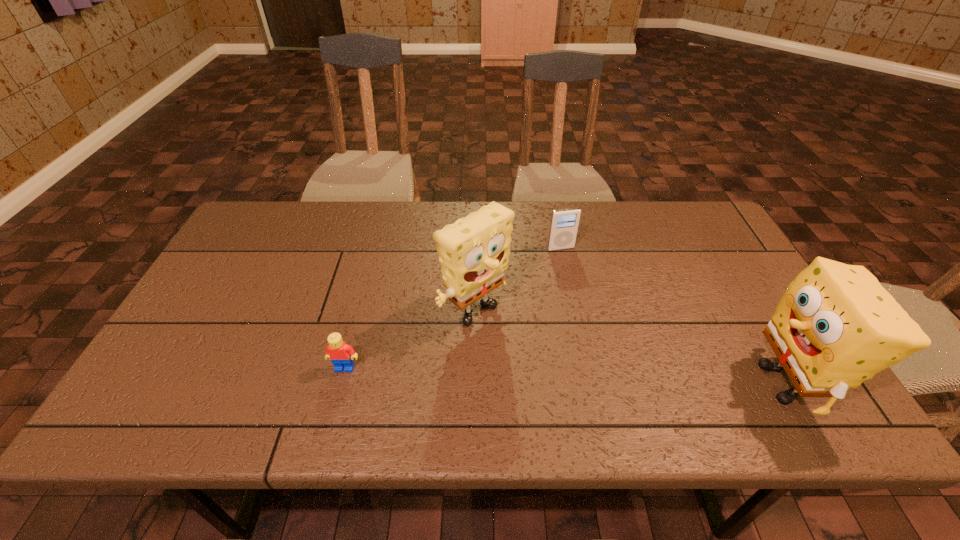
Image resolution: width=960 pixels, height=540 pixels. In order to click on the shortest object in this screenshot , I will do `click(341, 354)`.

Where is `the leftmost object`? This screenshot has width=960, height=540. the leftmost object is located at coordinates (341, 354).

The image size is (960, 540). Find the location of `the right sponge`. the right sponge is located at coordinates (836, 326).

Locate an element on the screen. This screenshot has width=960, height=540. the third object from right to left is located at coordinates (473, 251).

Where is `the third tallest object`? the third tallest object is located at coordinates (564, 223).

You are a GUI agent. You are given a task and a screenshot of the screen. Output one action in this format:
    pyautogui.click(x=<x>, y=<y>)
    Task: Click on the iPod
    The height and width of the screenshot is (540, 960).
    Given the screenshot: What is the action you would take?
    pyautogui.click(x=564, y=223)

Identify the location of free region located on the face of the right sponge. The height and width of the screenshot is (540, 960). (583, 383).

What are the coordinates of `vacant region located 0.250m on the face of the right sponge` in the screenshot? It's located at (636, 383).

Where is `vacant space positioned on the face of the right sponge`? The image size is (960, 540). vacant space positioned on the face of the right sponge is located at coordinates (569, 383).

This screenshot has height=540, width=960. I want to click on vacant space located 0.150m on the face of the left sponge, so click(x=545, y=381).